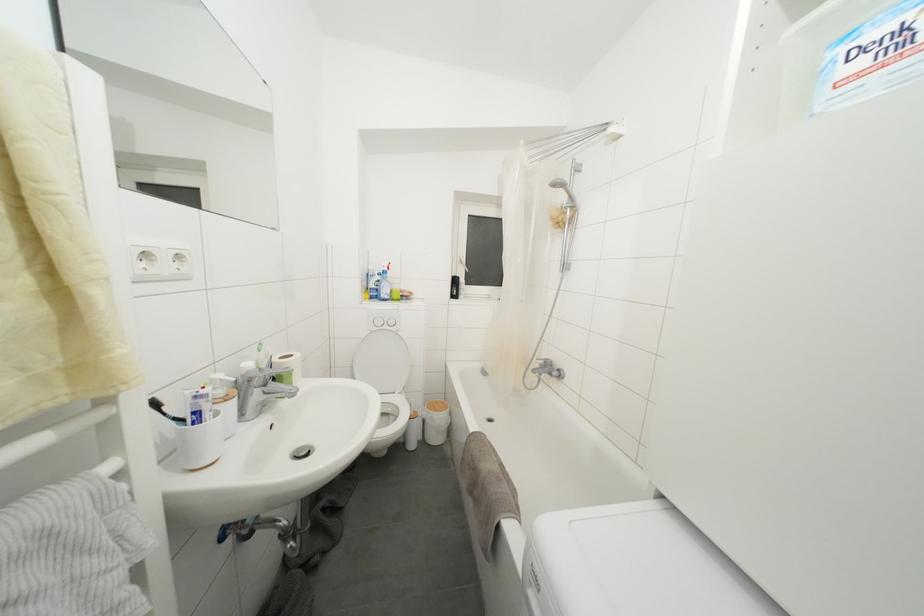
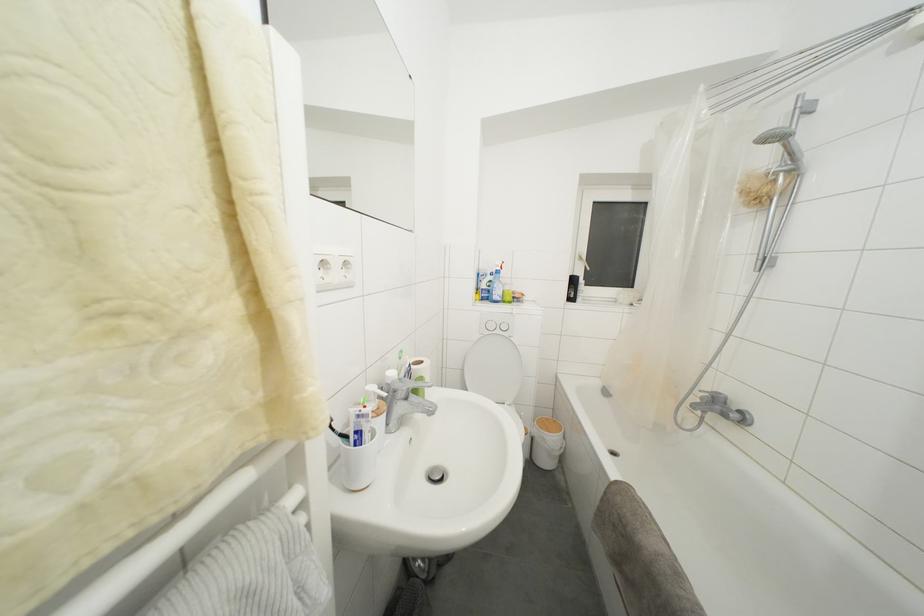
Find the pixel in the second image that matches (x=302, y=455) in the first image.

(436, 475)